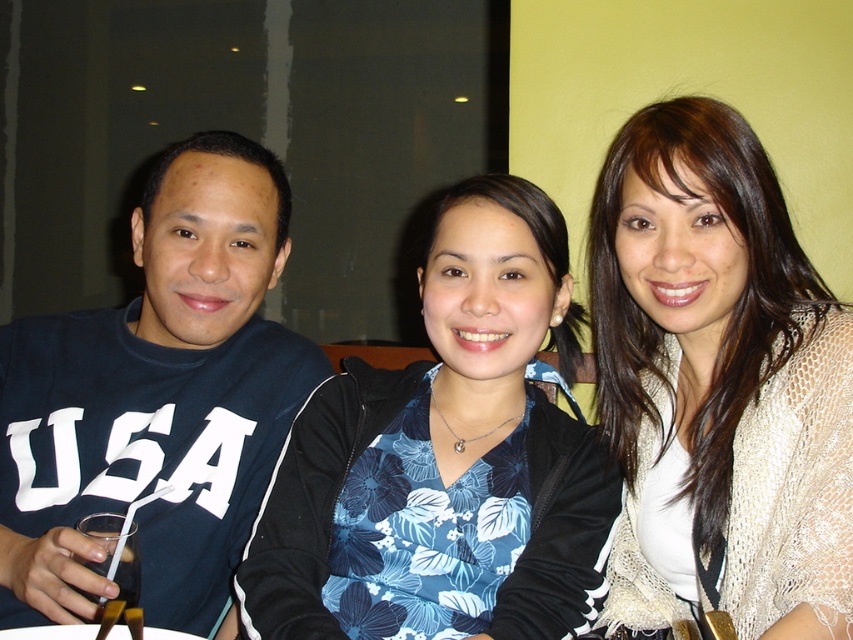
Is point (247, 173) behind point (126, 532)?

Yes.

Which is behind, point (172, 326) or point (123, 602)?

The point (172, 326) is behind.

At what (x,y) coordinates should I click in order to perform the action: click on blue fabric shirt at left. Please return your answer as a coordinate pair (x, y). Looking at the image, I should click on (155, 397).

Find the location of `blue fabric shirt at left`. blue fabric shirt at left is located at coordinates (155, 397).

Between blue floral blouse at center and clear plastic cup at lower left, which one has less height?

clear plastic cup at lower left is shorter.

The image size is (853, 640). What do you see at coordinates (444, 460) in the screenshot?
I see `blue floral blouse at center` at bounding box center [444, 460].

Find the location of `blue floral blouse at center`. blue floral blouse at center is located at coordinates (444, 460).

Is white lace shawl at center smaller than blue floral blouse at center?

Yes.

You are a GUI agent. You are given a task and a screenshot of the screen. Output one action in this format:
    pyautogui.click(x=<x>, y=<y>)
    Task: Click on the white lace shawl at center
    
    Given the screenshot: What is the action you would take?
    pyautogui.click(x=718, y=385)

At what (x,y) coordinates should I click in order to perform the action: click on white lace shawl at center. Please return your answer as a coordinate pair (x, y). Looking at the image, I should click on (718, 385).